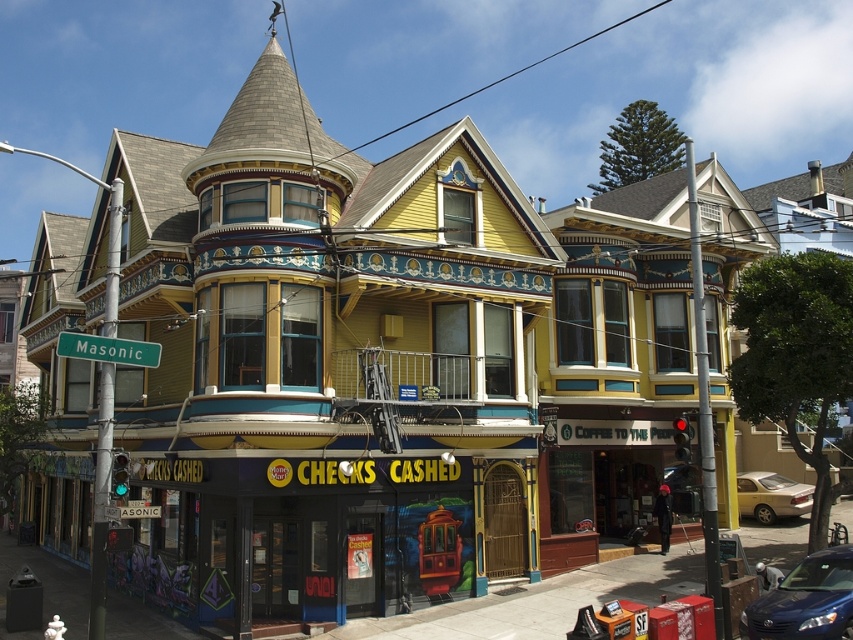
You are standing at the entrance of the Checks Cashed store and want to hail a taxi. The blue metallic sedan at lower right is parked nearby. Based on its position, can you estimate how far it is from your current location?

The blue metallic sedan at lower right is located at coordinates (805, 600), which would place it relatively close to your current position at the entrance. Since the coordinates are both close to 1, it is likely positioned near the lower right corner of the scene, making it a short distance away.

You are a delivery driver who needs to park your truck which is 10 meters long between the silver metallic sedan at lower right and the green metallic street sign at left. Is there enough space between them for your truck?

The distance between the silver metallic sedan at lower right and the green metallic street sign at left is 28.83 meters. Since your truck is 10 meters long, there is sufficient space to park between them.

You are a delivery driver who needs to park your vehicle near the Checks Cashed store. You see a blue metallic sedan at lower right and a green metallic street sign at left. Which vehicle should you park behind to stay closest to the store entrance?

You should park behind the blue metallic sedan at lower right because it is positioned on the right side of the green metallic street sign at left, placing it closer to the store entrance.